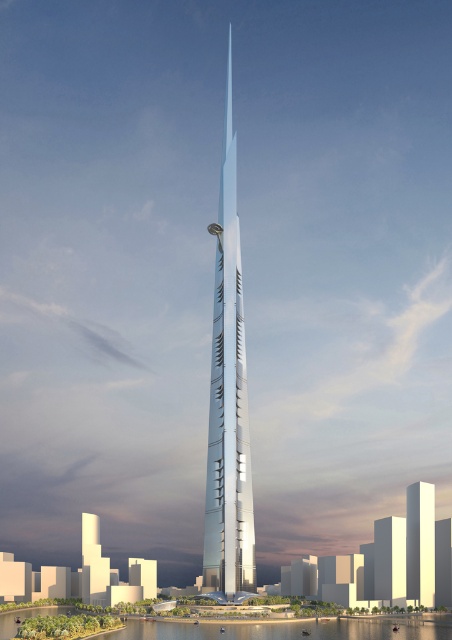
Question: Does shiny glass skyscraper at center appear on the right side of clear water at lower center?

Choices:
 (A) yes
 (B) no

Answer: (A)

Question: Which of the following is the farthest from the observer?

Choices:
 (A) pos(216,573)
 (B) pos(381,628)

Answer: (A)

Question: Which of these objects is positioned farthest from the shiny glass skyscraper at center?

Choices:
 (A) clear water at lower center
 (B) shiny silver tower at center

Answer: (B)

Question: Does shiny glass skyscraper at center lie behind shiny silver tower at center?

Choices:
 (A) yes
 (B) no

Answer: (B)

Question: Which of the following is the farthest from the observer?

Choices:
 (A) shiny glass skyscraper at center
 (B) shiny silver tower at center
 (C) clear water at lower center

Answer: (B)

Question: Does shiny glass skyscraper at center come behind clear water at lower center?

Choices:
 (A) no
 (B) yes

Answer: (B)